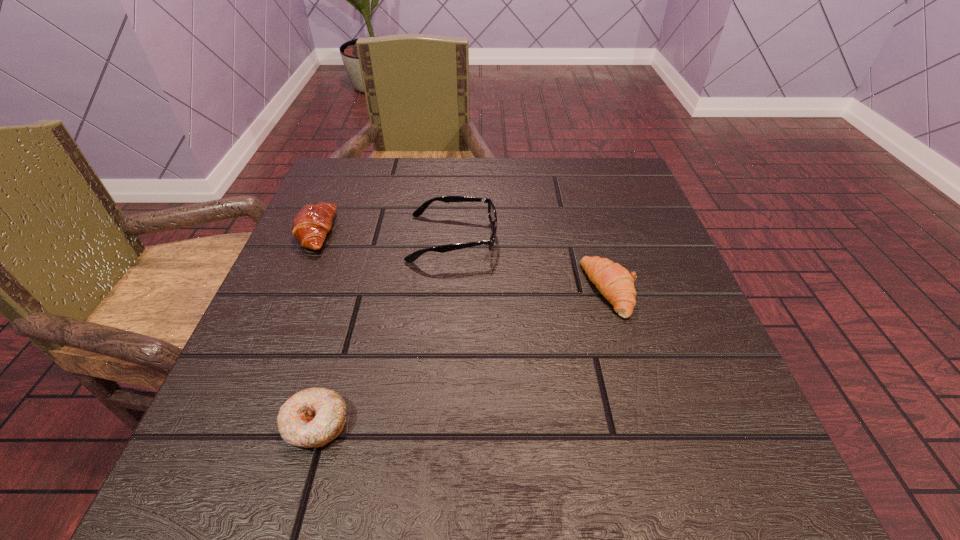
The image size is (960, 540). In order to click on spectacles in this screenshot , I will do `click(492, 214)`.

You are a GUI agent. You are given a task and a screenshot of the screen. Output one action in this format:
    pyautogui.click(x=<x>, y=<y>)
    Task: Click on the left crescent roll
    This screenshot has width=960, height=540.
    Given the screenshot: What is the action you would take?
    pyautogui.click(x=311, y=224)

Find the location of a particular element. the farther crescent roll is located at coordinates (311, 224).

Where is `the right crescent roll`? This screenshot has height=540, width=960. the right crescent roll is located at coordinates (614, 282).

Identify the location of the nearer crescent roll. The width and height of the screenshot is (960, 540). (614, 282).

Locate an element on the screen. the shortest object is located at coordinates (311, 418).

At what (x,y) coordinates should I click in order to perform the action: click on the second object from left to right. Please return your answer as a coordinate pair (x, y). The image size is (960, 540). Looking at the image, I should click on (311, 418).

The image size is (960, 540). Find the location of `free space located on the front-facing side of the third object from left to right`. free space located on the front-facing side of the third object from left to right is located at coordinates (626, 238).

Identify the location of vacant space located 0.230m on the front of the farther crescent roll. The height and width of the screenshot is (540, 960). (263, 353).

Find the location of a particular element. This screenshot has width=960, height=540. free region located 0.180m on the back of the right crescent roll is located at coordinates (586, 207).